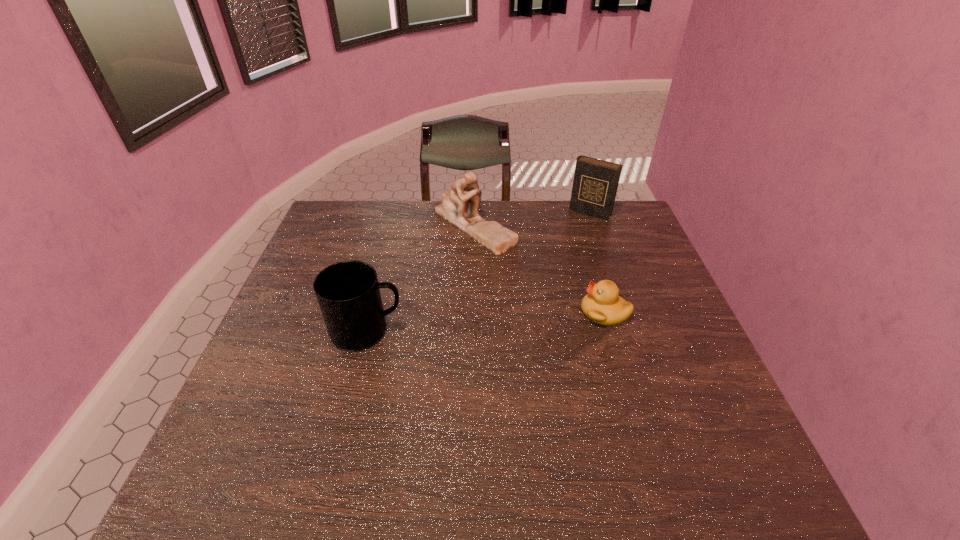
Image resolution: width=960 pixels, height=540 pixels. I want to click on vacant space at the far edge of the desktop, so click(x=494, y=214).

At what (x,y) coordinates should I click in order to perform the action: click on vacant space at the near edge of the desktop. Please return your answer as a coordinate pair (x, y). This screenshot has height=540, width=960. Looking at the image, I should click on (488, 418).

In order to click on free space at the left edge in this screenshot , I will do `click(294, 288)`.

Find the location of a particular element. This screenshot has width=960, height=540. vacant space at the right edge of the desktop is located at coordinates (681, 387).

In the image, there is a desktop. Where is `vacant space at the far left corner`? The height and width of the screenshot is (540, 960). vacant space at the far left corner is located at coordinates (334, 231).

Where is `vacant space at the near left corner of the desktop`? Image resolution: width=960 pixels, height=540 pixels. vacant space at the near left corner of the desktop is located at coordinates (252, 418).

Identify the location of vacant space that's between the leftmost object and the shortest object. click(x=486, y=321).

Locate an element on the screen. This screenshot has width=960, height=540. vacant space that is in between the mug and the third object from right to left is located at coordinates (420, 278).

Locate an element on the screen. Image resolution: width=960 pixels, height=540 pixels. vacant region between the mug and the diary is located at coordinates (479, 272).

You are a GUI agent. You are given a task and a screenshot of the screen. Output one action in this format:
    pyautogui.click(x=<x>, y=<y>)
    Task: Click on the vacant space that is in between the diary and the shortest object
    
    Given the screenshot: What is the action you would take?
    pyautogui.click(x=597, y=262)